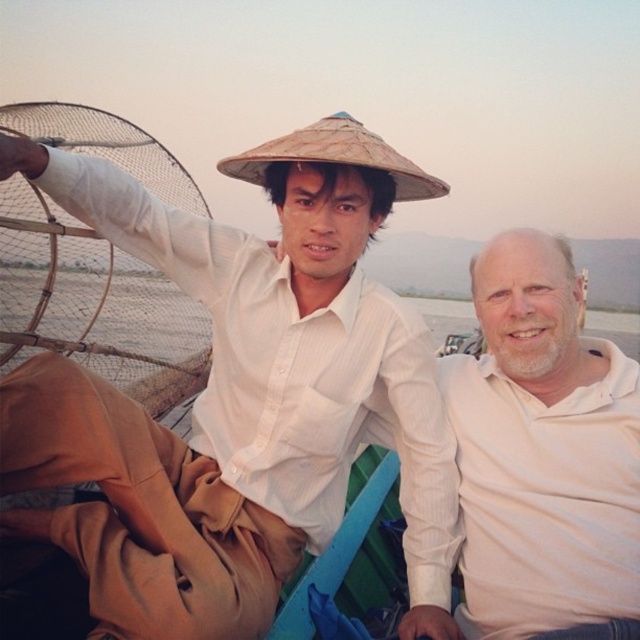
Question: Which object is closer to the camera taking this photo?

Choices:
 (A) brown straw hat at upper center
 (B) matte straw hat at upper center
 (C) brown mesh fishing net at left
 (D) white cotton shirt at center

Answer: (B)

Question: Which point appears closest to the camera in this image?

Choices:
 (A) (83, 264)
 (B) (426, 188)

Answer: (B)

Question: Which point is farther from the camera taking this photo?

Choices:
 (A) (598, 557)
 (B) (278, 584)

Answer: (B)

Question: Is matte straw hat at upper center thinner than white cotton shirt at center?

Choices:
 (A) yes
 (B) no

Answer: (B)

Question: Is the position of white cotton shirt at center less distant than that of brown straw hat at upper center?

Choices:
 (A) no
 (B) yes

Answer: (B)

Question: From the image, what is the correct spatial relationship of white cotton shirt at center in relation to brown mesh fishing net at left?

Choices:
 (A) right
 (B) left

Answer: (A)